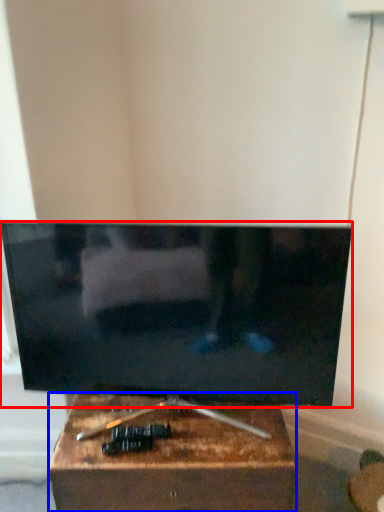
Question: Which point is closer to the camera, television (highlighted by a red box) or furniture (highlighted by a blue box)?

Choices:
 (A) television
 (B) furniture

Answer: (A)